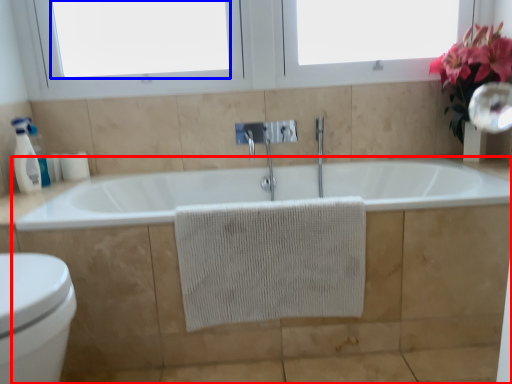
Question: Among these objects, which one is nearest to the camera, bath (highlighted by a red box) or window screen (highlighted by a blue box)?

Choices:
 (A) bath
 (B) window screen

Answer: (A)